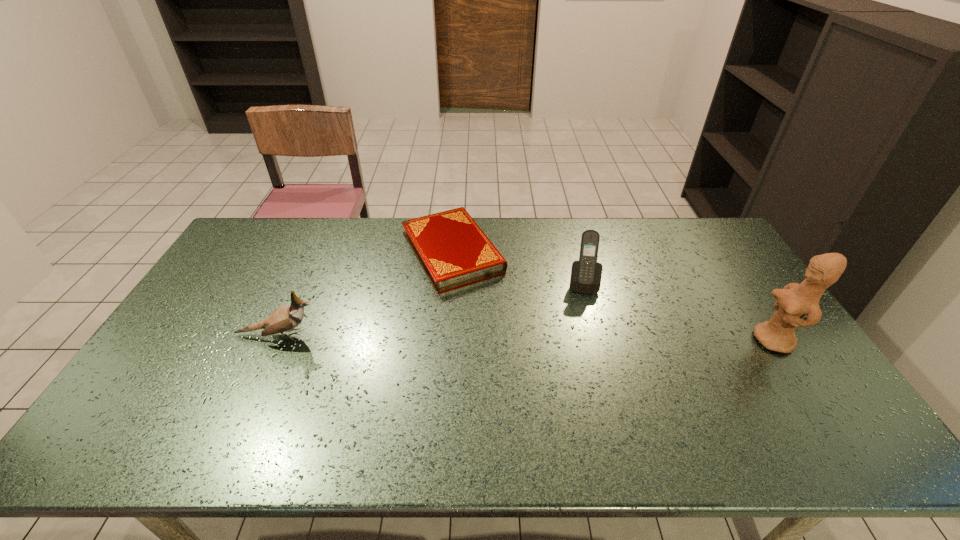
You are a GUI agent. You are given a task and a screenshot of the screen. Output one action in this format:
    pyautogui.click(x=<x>, y=<y>)
    Task: Click on the leftmost object
    The width and height of the screenshot is (960, 540).
    Given the screenshot: What is the action you would take?
    pyautogui.click(x=285, y=318)

Identify the location of the rightmost object. The width and height of the screenshot is (960, 540). (795, 300).

Where is `figurine`? This screenshot has height=540, width=960. figurine is located at coordinates (795, 300).

I want to click on the third object from right to left, so click(453, 251).

Locate an element on the screen. the shortest object is located at coordinates (453, 251).

In order to click on cellular telephone in this screenshot , I will do pyautogui.click(x=586, y=274).

Find the location of a particular element. free space located at the face of the leftmost object is located at coordinates 342,335.

Find the location of a particular element. The height and width of the screenshot is (540, 960). vacant space located 0.160m on the front-facing side of the tallest object is located at coordinates (698, 340).

Find the location of a particular element. This screenshot has width=960, height=540. vacant region located on the front-facing side of the tallest object is located at coordinates (638, 340).

You are a GUI agent. You are given a task and a screenshot of the screen. Output one action in this format:
    pyautogui.click(x=<x>, y=<y>)
    Task: Click on the vacant space located 0.170m on the front-facing side of the tallest object
    This screenshot has height=540, width=960.
    Given the screenshot: What is the action you would take?
    pyautogui.click(x=695, y=340)